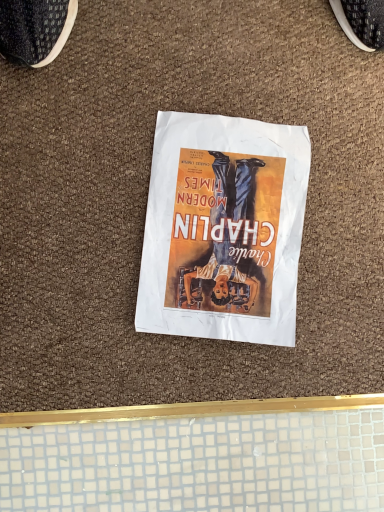
The width and height of the screenshot is (384, 512). Find the location of `vacant area on top of matte paper poster at center (from a real-world perspective)`. vacant area on top of matte paper poster at center (from a real-world perspective) is located at coordinates (225, 228).